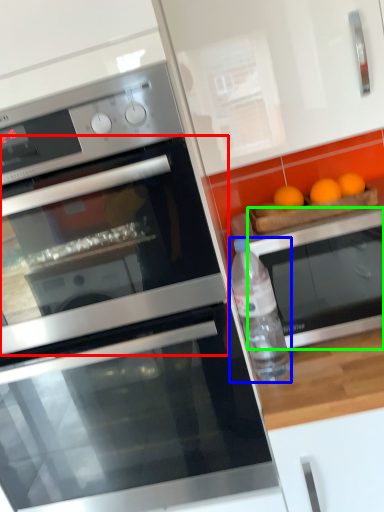
Question: Based on their relative distances, which object is nearer to oven (highlighted by a red box)? Choose from bottle (highlighted by a blue box) and oven (highlighted by a green box).

Choices:
 (A) bottle
 (B) oven

Answer: (A)